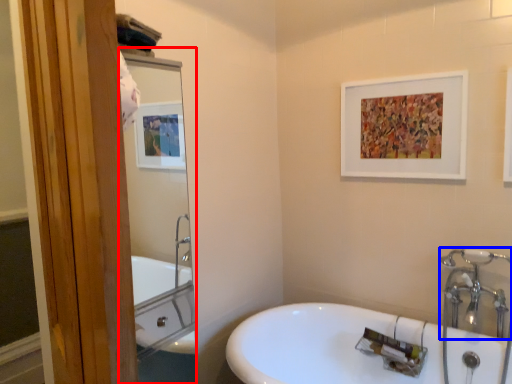
Question: Which object appears closest to the camera in this image, mirror (highlighted by a red box) or plumbing fixture (highlighted by a blue box)?

Choices:
 (A) mirror
 (B) plumbing fixture

Answer: (A)